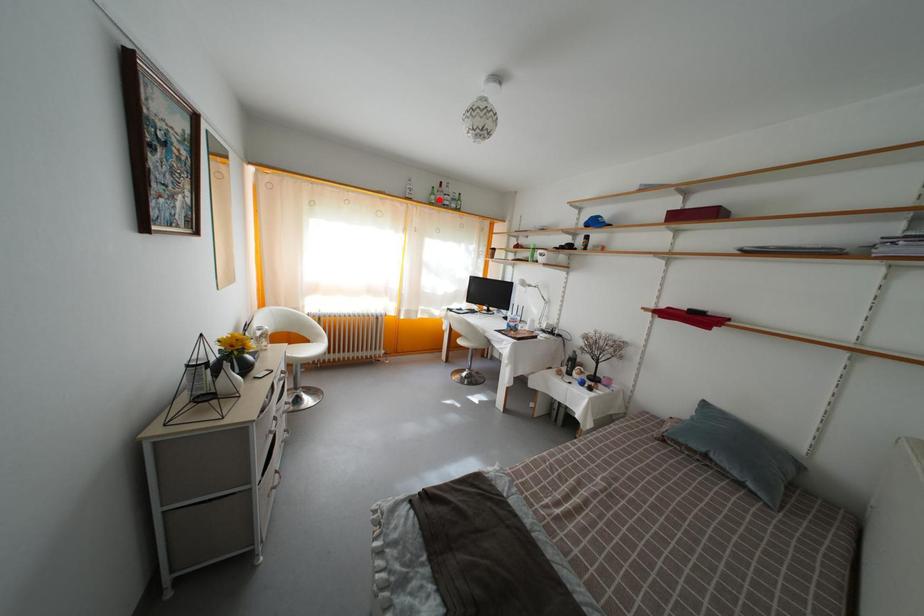
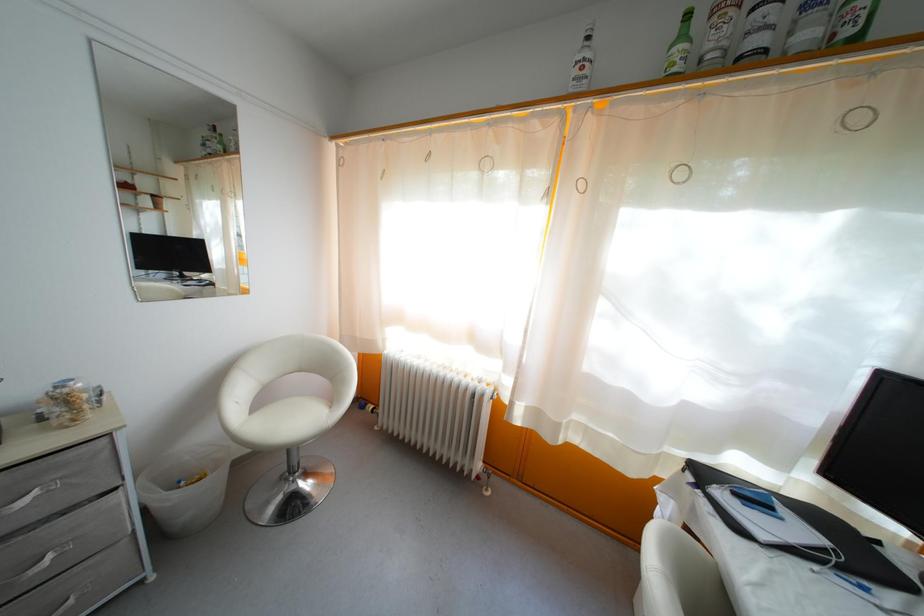
Question: I am providing you with two images of the same scene from different viewpoints. Image1 has a red point marked. In image2, the corresponding 3D location appears at what relative position? Reply with the corresponding letter.

Choices:
 (A) Closer
 (B) Farther

Answer: (B)